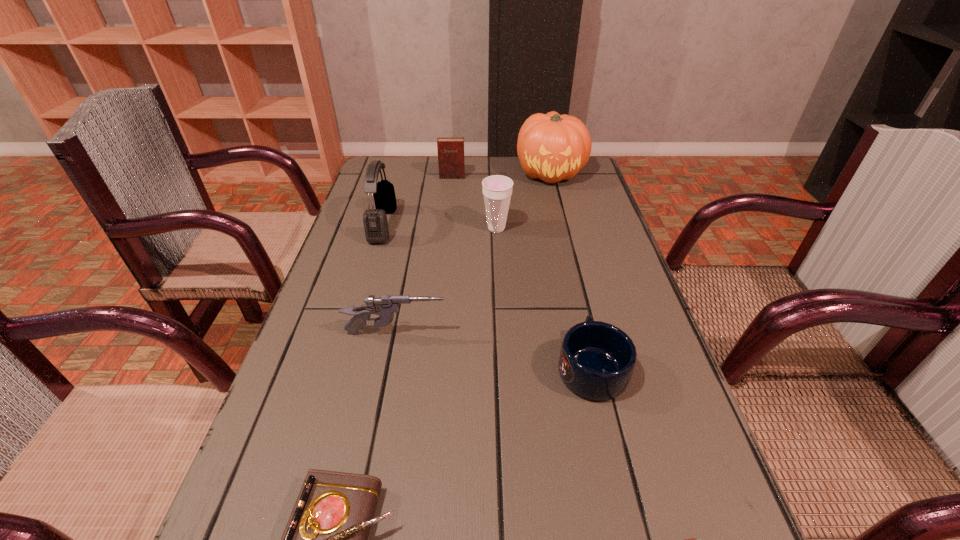
Where is `object that is at the far right corner`? object that is at the far right corner is located at coordinates (552, 147).

Image resolution: width=960 pixels, height=540 pixels. I want to click on free space at the far edge of the desktop, so click(x=465, y=159).

At what (x,y) coordinates should I click in order to perform the action: click on free space at the left edge of the desktop. Please return your answer as a coordinate pair (x, y). This screenshot has width=960, height=540. Looking at the image, I should click on click(367, 261).

This screenshot has width=960, height=540. Identify the location of vacant space at the right edge of the desktop. (557, 239).

In order to click on vacant region at the far left corner of the desktop in this screenshot , I will do `click(406, 185)`.

You are a GUI agent. You are given a task and a screenshot of the screen. Output one action in this format:
    pyautogui.click(x=<x>, y=<y>)
    Task: Click on the unoccupied area between the third shortest object and the pumpkin
    
    Given the screenshot: What is the action you would take?
    pyautogui.click(x=571, y=270)

The height and width of the screenshot is (540, 960). Find the location of `unoccupied area between the pumpkin and the headset`. unoccupied area between the pumpkin and the headset is located at coordinates (467, 199).

At what (x,y) coordinates should I click in order to perform the action: click on unoccupied area between the cup and the fifth tallest object. Please return your answer as a coordinate pair (x, y). The width and height of the screenshot is (960, 540). Looking at the image, I should click on [x=446, y=281].

The height and width of the screenshot is (540, 960). What are the coordinates of `vacant space in between the gun and the headset` in the screenshot? It's located at (390, 279).

The width and height of the screenshot is (960, 540). Identify the location of object that is the seventh closest to the cup. (691, 539).